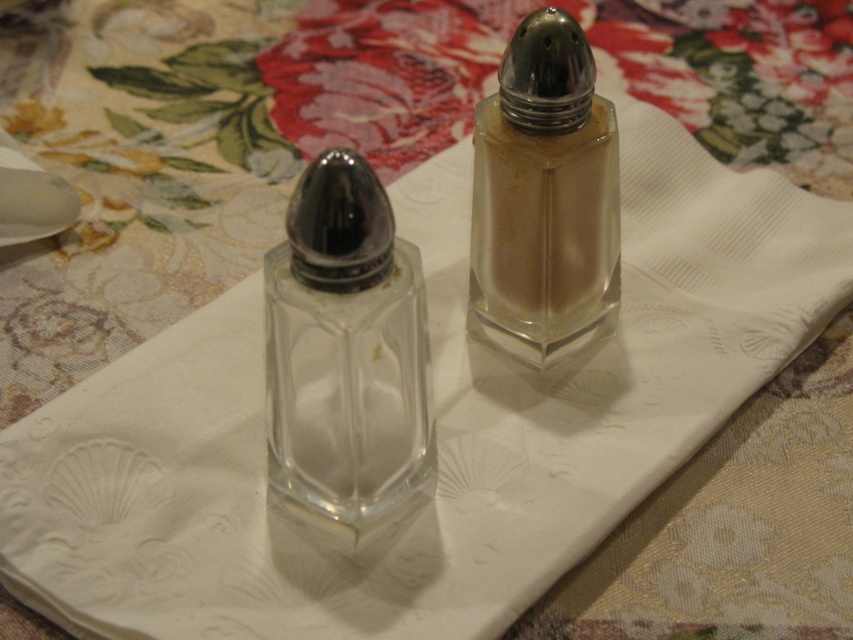
You are setting up a dining table and need to place both the transparent glass salt shaker at center and the clear glass salt shaker at center. Since space is limited, which one should you place first to ensure both fit?

The transparent glass salt shaker at center occupies less space than the clear glass salt shaker at center, so you should place the transparent glass salt shaker at center first to ensure both fit.

You are setting up a dinner table and have two salt shakers. The transparent glass salt shaker at center and the clear glass salt shaker at center are both on the table. Which one is narrower?

The transparent glass salt shaker at center is narrower than the clear glass salt shaker at center.

You are setting up a dining table and need to place two salt shakers. The table has a small space between them where you want to place a small herb container. The transparent glass salt shaker at center and the clear glass salt shaker at center are currently placed on the table. If the herb container requires 20 centimeters of space between the two shakers, will there be enough space?

The transparent glass salt shaker at center is 18.87 centimeters from the clear glass salt shaker at center. Since the required space for the herb container is 20 centimeters, there is not enough space between them.